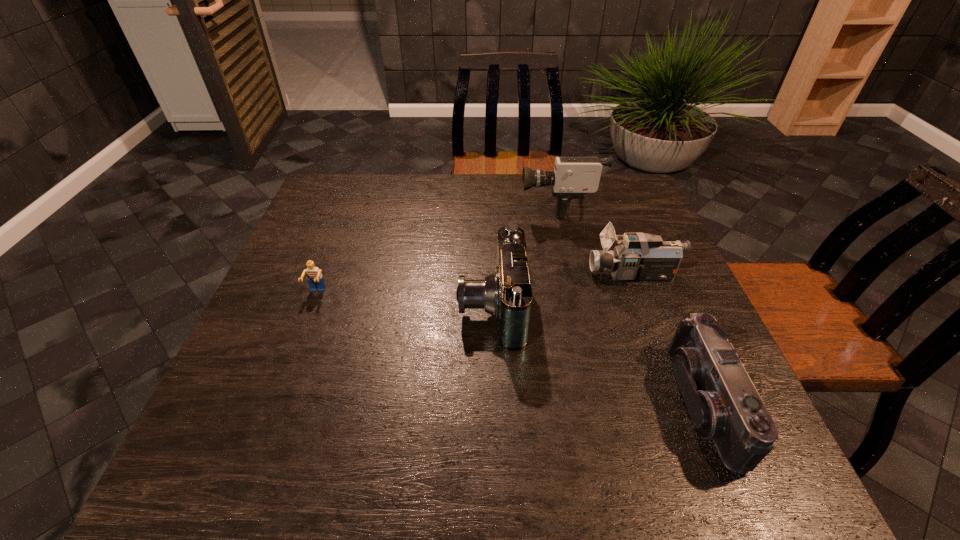
The image size is (960, 540). I want to click on free location located 0.190m on the front-facing side of the fourth object from right to left, so click(377, 306).

Locate an element on the screen. The width and height of the screenshot is (960, 540). blank space located 0.220m on the face of the Lego is located at coordinates (285, 377).

The image size is (960, 540). In order to click on object that is at the far edge in this screenshot , I will do `click(573, 177)`.

The image size is (960, 540). In order to click on object at the near edge in this screenshot , I will do `click(723, 404)`.

In order to click on object at the left edge in this screenshot , I will do `click(314, 276)`.

This screenshot has width=960, height=540. Find the location of `object at the far right corner`. object at the far right corner is located at coordinates (573, 177).

Identify the location of object at the near right corner. Image resolution: width=960 pixels, height=540 pixels. (723, 404).

Locate an element on the screen. The height and width of the screenshot is (540, 960). vacant area at the far edge of the desktop is located at coordinates (436, 180).

In the image, there is a desktop. Where is `free space at the near edge`? free space at the near edge is located at coordinates 630,449.

What are the coordinates of `blank area at the left edge` in the screenshot? It's located at (289, 307).